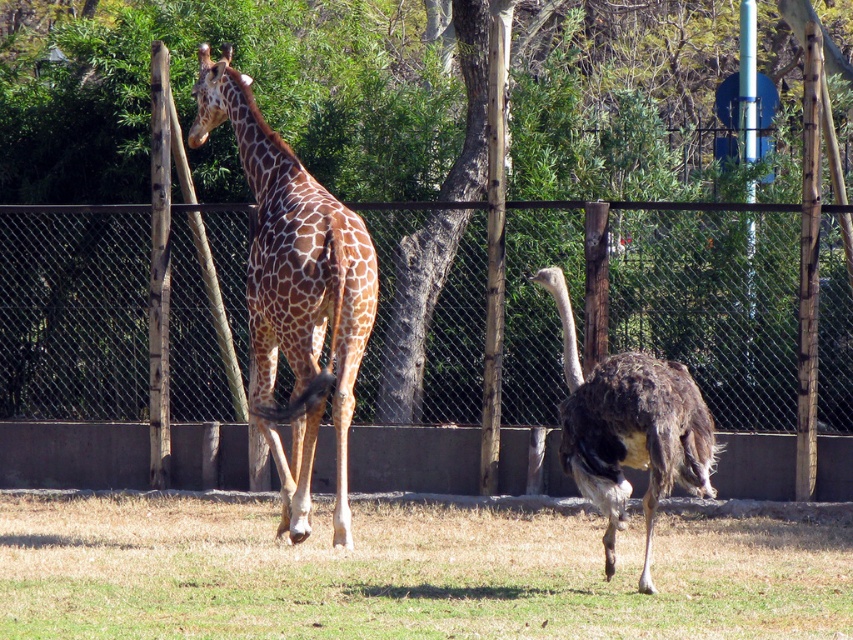
Is green dry grass at lower center smaller than brown feathered ostrich at center?

Yes, green dry grass at lower center is smaller than brown feathered ostrich at center.

Is point (688, 544) closer to viewer compared to point (666, 451)?

No.

The width and height of the screenshot is (853, 640). I want to click on green dry grass at lower center, so click(x=405, y=573).

Which is above, metallic wire mesh at center or brown feathered ostrich at center?

metallic wire mesh at center is higher up.

This screenshot has height=640, width=853. What are the coordinates of `metallic wire mesh at center` in the screenshot? It's located at coord(712,305).

Which is in front, point (445, 349) or point (422, 577)?

Point (422, 577)

Does metallic wire mesh at center have a greater width compared to green dry grass at lower center?

No, metallic wire mesh at center is not wider than green dry grass at lower center.

Describe the element at coordinates (712, 305) in the screenshot. I see `metallic wire mesh at center` at that location.

This screenshot has width=853, height=640. Find the location of `metallic wire mesh at center`. metallic wire mesh at center is located at coordinates (712, 305).